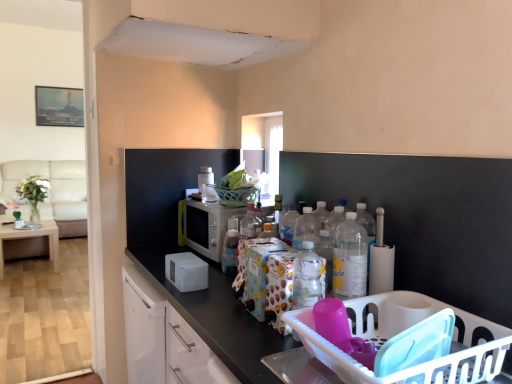
Question: Does point (34, 213) appear closer or farther from the camera than point (339, 228)?

Choices:
 (A) farther
 (B) closer

Answer: (A)

Question: In terms of width, does green leafy plant in clear vase at left look wider or thinner when compared to clear plastic bottle at center-right, which appears as the 1th bottle when viewed from the front?

Choices:
 (A) wide
 (B) thin

Answer: (A)

Question: Considering the real-world distances, which object is closest to the green leafy plant in clear vase at left?

Choices:
 (A) transparent glass window at center
 (B) translucent plastic bottle at center, which is the 1th bottle from left to right
 (C) light brown wooden table at left
 (D) white plastic toaster at upper center, the 2th appliance from the bottom
 (E) clear plastic bottle at center-right, the second bottle positioned from the back

Answer: (C)

Question: Estimate the real-world distances between objects in this image. Which object is closer to the beige fabric couch at left?

Choices:
 (A) silver metallic microwave at center, the first appliance in the bottom-to-top sequence
 (B) light brown wooden table at left
 (C) white plastic basket at lower right
 (D) green leafy plant in clear vase at left
 (E) clear plastic bottle at center-right, the second bottle positioned from the back

Answer: (D)